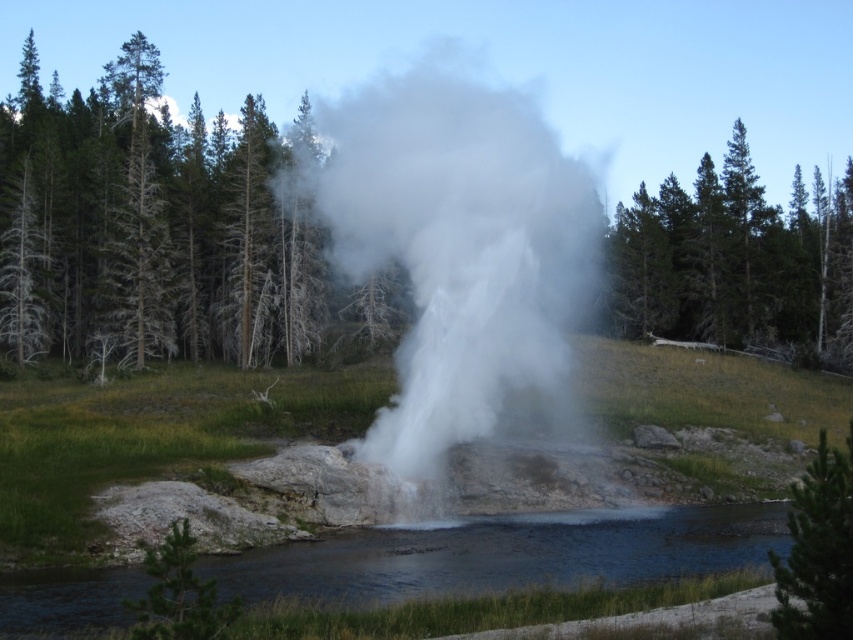
Question: Can you confirm if clear water at lower center is smaller than green leafy tree at upper right?

Choices:
 (A) no
 (B) yes

Answer: (B)

Question: Which of the following is the farthest from the observer?

Choices:
 (A) (798, 502)
 (B) (802, 360)

Answer: (B)

Question: Which object is the closest to the green leafy tree at upper right?

Choices:
 (A) white vapor at center
 (B) green textured pine tree at lower right

Answer: (A)

Question: Can you confirm if white vapor at center is thinner than green textured pine tree at lower right?

Choices:
 (A) no
 (B) yes

Answer: (A)

Question: Which of the following is the farthest from the observer?

Choices:
 (A) (397, 177)
 (B) (24, 616)
 (C) (820, 486)
 (D) (717, 228)

Answer: (D)

Question: Does white vapor at center have a greater width compared to clear water at lower center?

Choices:
 (A) yes
 (B) no

Answer: (A)